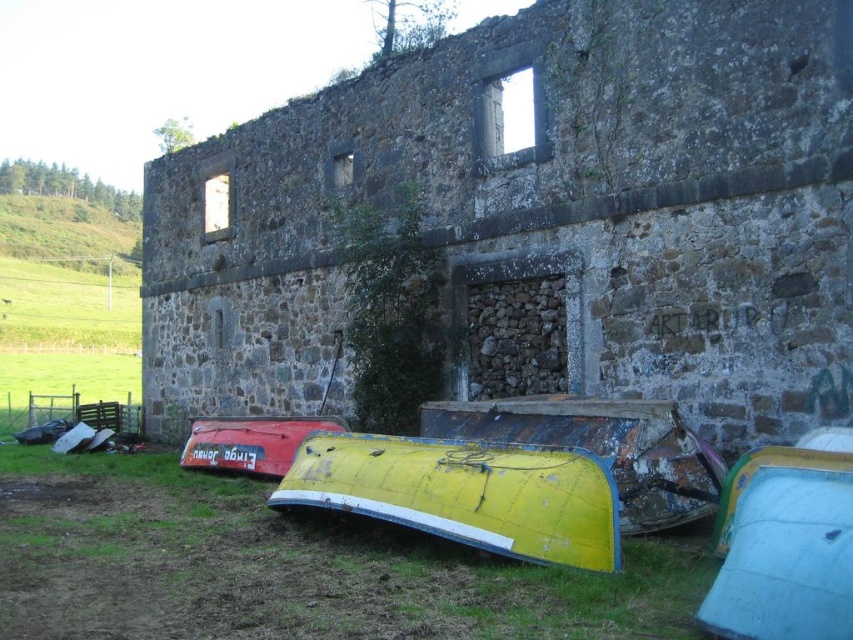
You are a gardener who wants to mow the green grass at lower left. However, there is a red matte boat at lower left in the way. Can you mow the grass without moving the boat?

The green grass at lower left is not as tall as the red matte boat at lower left, so you can mow the grass without moving the boat because the grass is shorter than the boat.